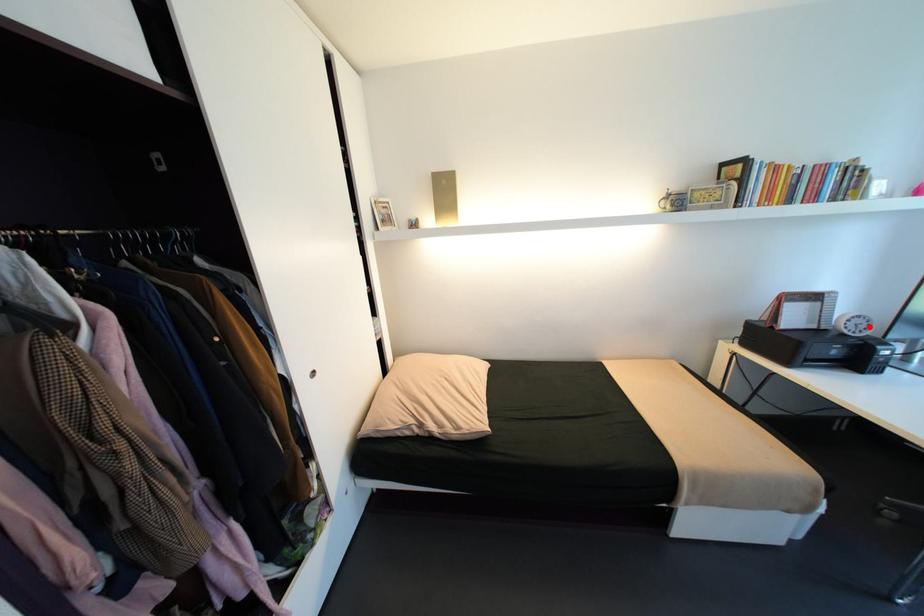
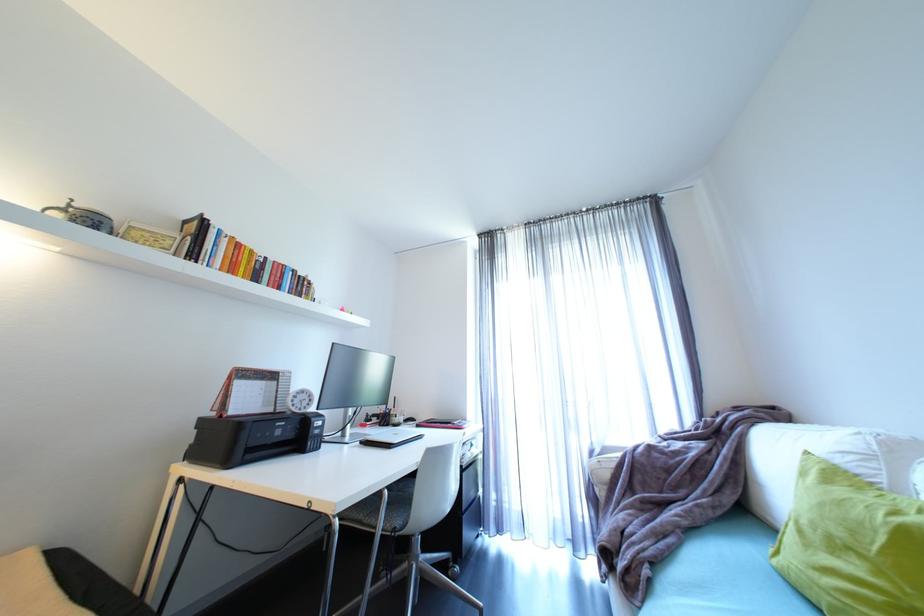
Find the pixel in the second image that matches the highlighted location in the first image.

(312, 402)